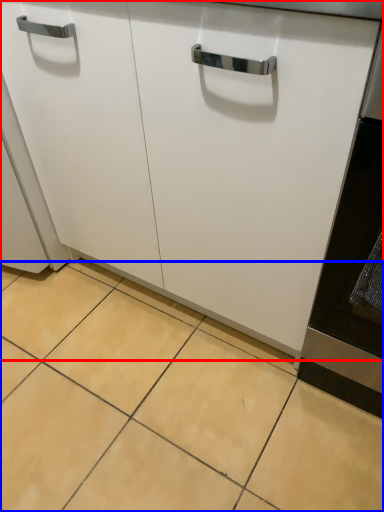
Question: Among these objects, which one is nearest to the camera, cabinetry (highlighted by a red box) or ceramic tile (highlighted by a blue box)?

Choices:
 (A) cabinetry
 (B) ceramic tile

Answer: (A)